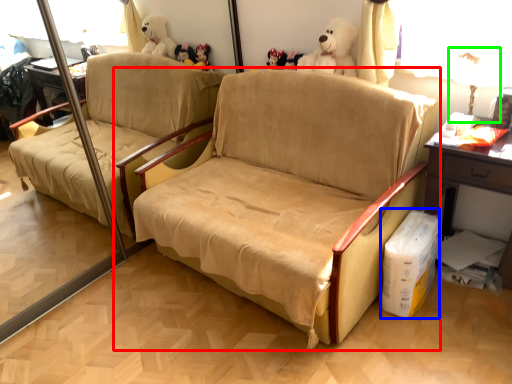
Question: Which object is the farthest from studio couch (highlighted by a red box)? Choose among these: cardboard box (highlighted by a blue box) or table lamp (highlighted by a green box).

Choices:
 (A) cardboard box
 (B) table lamp

Answer: (B)